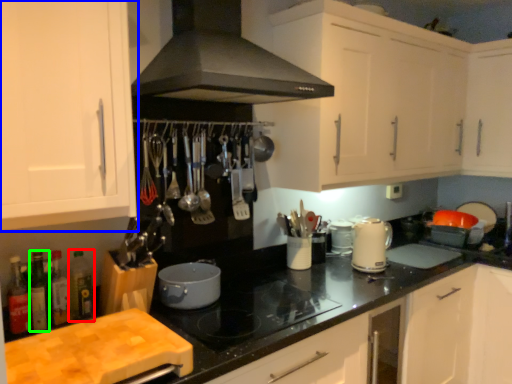
Question: Which object is the farthest from bottle (highlighted by a red box)? Choose among these: cabinetry (highlighted by a blue box) or bottle (highlighted by a green box).

Choices:
 (A) cabinetry
 (B) bottle

Answer: (A)